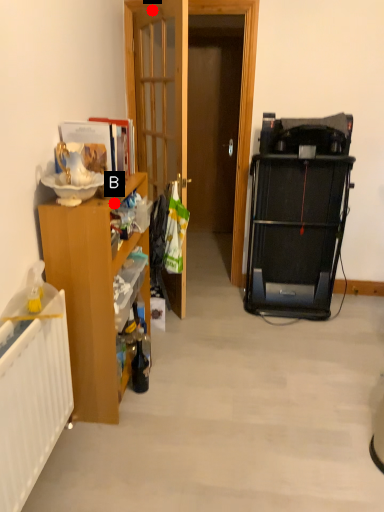
Question: Two points are circled on the image, labeled by A and B beside each circle. Among these points, which one is farthest from the camera?

Choices:
 (A) A is further
 (B) B is further

Answer: (A)